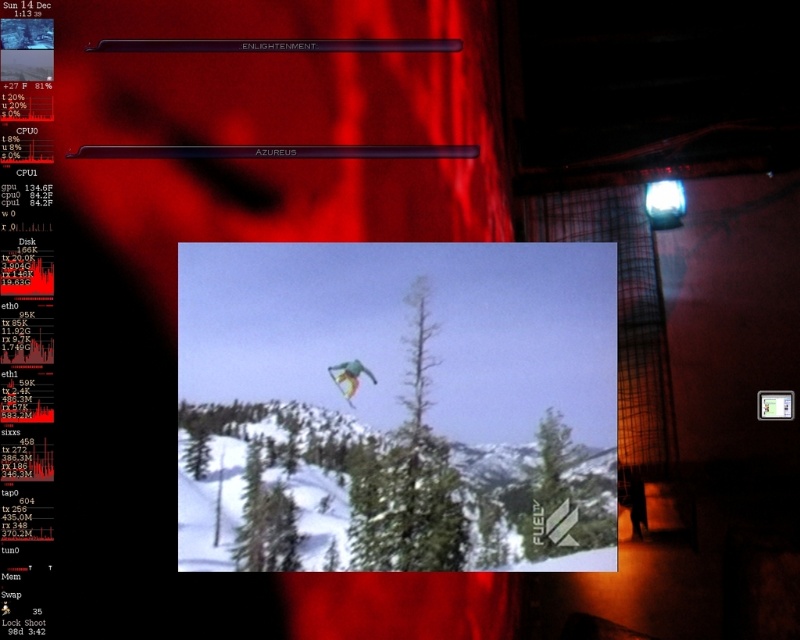
Question: From the image, what is the correct spatial relationship of green fabric kite at center in relation to multicolored fabric snowboarder at center?

Choices:
 (A) right
 (B) left

Answer: (A)

Question: Can you confirm if green fabric kite at center is thinner than multicolored fabric snowboarder at center?

Choices:
 (A) no
 (B) yes

Answer: (A)

Question: Is green fabric kite at center to the left of multicolored fabric snowboarder at center from the viewer's perspective?

Choices:
 (A) no
 (B) yes

Answer: (A)

Question: Which object appears closest to the camera in this image?

Choices:
 (A) green fabric kite at center
 (B) multicolored fabric snowboarder at center

Answer: (A)

Question: Which of the following is the farthest from the observer?

Choices:
 (A) (422, 317)
 (B) (350, 392)

Answer: (A)